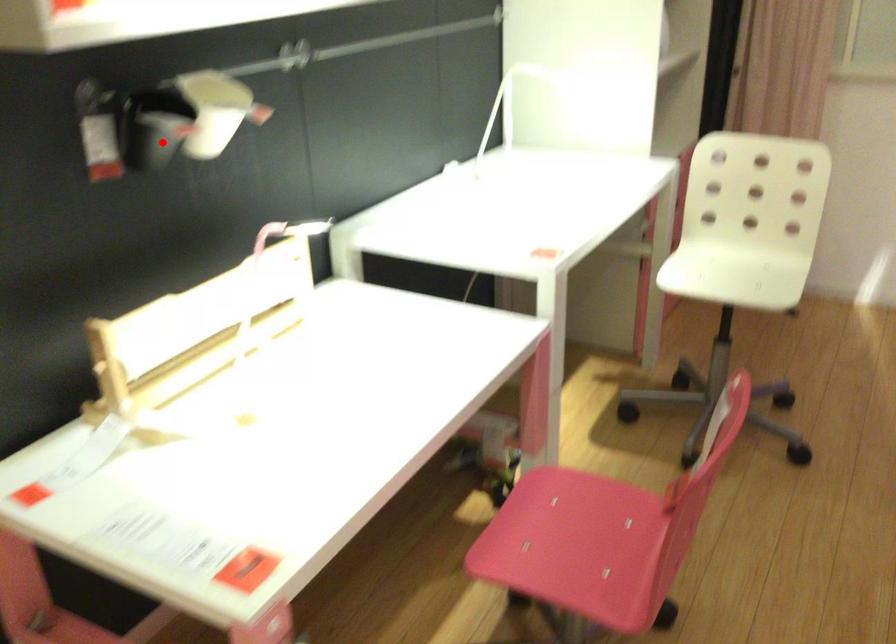
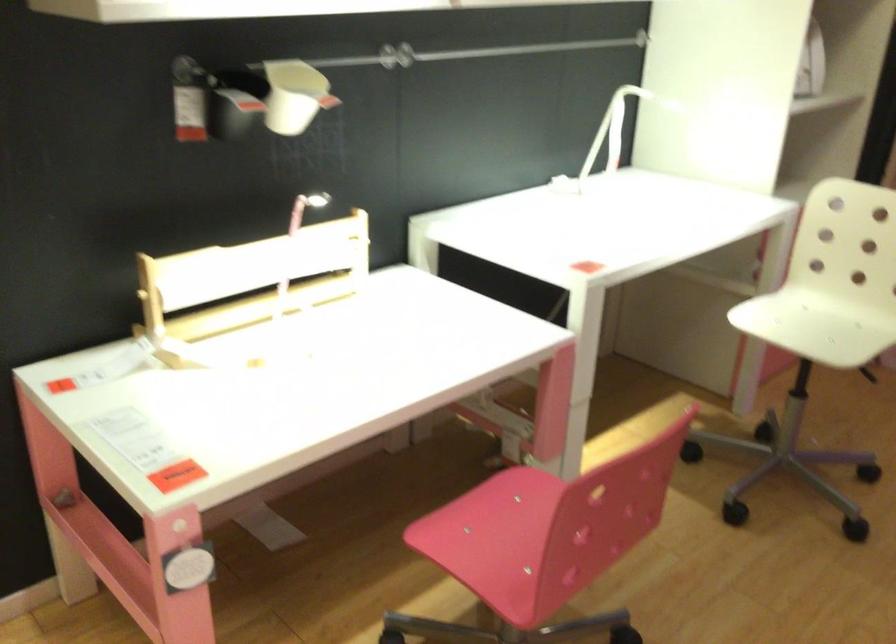
Question: I am providing you with two images of the same scene from different viewpoints. Image1 has a red point marked. In image2, the corresponding 3D location appears at what relative position? Reply with the corresponding letter.

Choices:
 (A) Closer
 (B) Farther

Answer: (B)